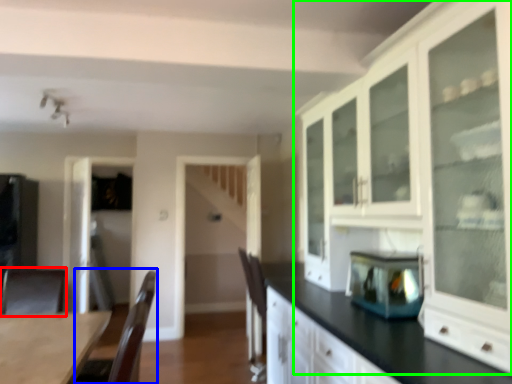
Question: Which object is the farthest from armchair (highlighted by a red box)? Choose among these: armchair (highlighted by a blue box) or cabinetry (highlighted by a green box).

Choices:
 (A) armchair
 (B) cabinetry

Answer: (B)